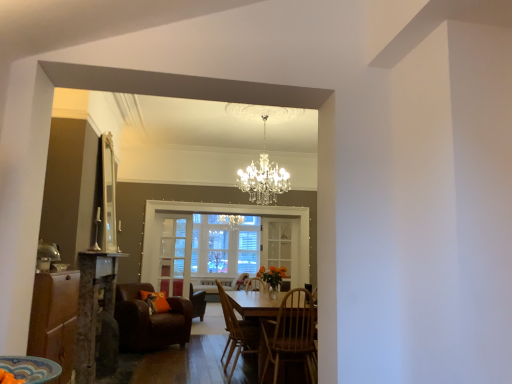
Question: Which direction should I rotate to look at clear glass door at center, which appears as the first glass door when viewed from the right, — up or down?

Choices:
 (A) down
 (B) up

Answer: (A)

Question: Considering the relative positions of translucent glass bowl at lower left and wooden cabinet at lower left in the image provided, is translucent glass bowl at lower left in front of wooden cabinet at lower left?

Choices:
 (A) no
 (B) yes

Answer: (B)

Question: Does translucent glass bowl at lower left appear on the right side of wooden cabinet at lower left?

Choices:
 (A) no
 (B) yes

Answer: (B)

Question: Is wooden cabinet at lower left at the back of translucent glass bowl at lower left?

Choices:
 (A) yes
 (B) no

Answer: (B)

Question: From a real-world perspective, is translucent glass bowl at lower left positioned under wooden cabinet at lower left based on gravity?

Choices:
 (A) yes
 (B) no

Answer: (B)

Question: Is translucent glass bowl at lower left completely or partially outside of wooden cabinet at lower left?

Choices:
 (A) yes
 (B) no

Answer: (A)

Question: From the image's perspective, is translucent glass bowl at lower left located beneath wooden cabinet at lower left?

Choices:
 (A) yes
 (B) no

Answer: (B)

Question: Is wooden chair at center, which is the fourth chair from back to front, not within translucent glass bowl at lower left?

Choices:
 (A) yes
 (B) no

Answer: (A)

Question: Is wooden chair at center, which is the fourth chair from back to front, shorter than translucent glass bowl at lower left?

Choices:
 (A) no
 (B) yes

Answer: (A)

Question: From the image's perspective, does wooden chair at center, which ranks as the first chair in front-to-back order, appear higher than translucent glass bowl at lower left?

Choices:
 (A) no
 (B) yes

Answer: (A)

Question: Would you consider wooden chair at center, which is the fourth chair from back to front, to be distant from translucent glass bowl at lower left?

Choices:
 (A) no
 (B) yes

Answer: (B)

Question: Is wooden chair at center, which is the fourth chair from back to front, turned away from translucent glass bowl at lower left?

Choices:
 (A) yes
 (B) no

Answer: (B)

Question: Can you see wooden chair at center, which ranks as the first chair in front-to-back order, touching translucent glass bowl at lower left?

Choices:
 (A) no
 (B) yes

Answer: (A)

Question: Is clear glass window at center behind wooden chair at center, the 3th chair from the back?

Choices:
 (A) no
 (B) yes

Answer: (B)